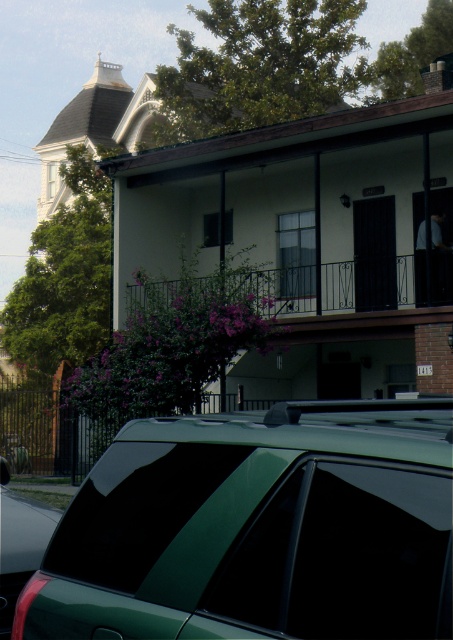
Question: Which object is the farthest from the metallic green car at lower left?

Choices:
 (A) iron black balcony at center
 (B) green matte car at lower center

Answer: (A)

Question: Is green matte car at lower center thinner than iron black balcony at center?

Choices:
 (A) no
 (B) yes

Answer: (A)

Question: Does iron black balcony at center appear on the left side of metallic green car at lower left?

Choices:
 (A) yes
 (B) no

Answer: (B)

Question: Among these points, which one is nearest to the camera?

Choices:
 (A) (197, 579)
 (B) (299, 312)

Answer: (A)

Question: Which object is farther from the camera taking this photo?

Choices:
 (A) green matte car at lower center
 (B) metallic green car at lower left
 (C) iron black balcony at center

Answer: (C)

Question: Is iron black balcony at center positioned in front of metallic green car at lower left?

Choices:
 (A) yes
 (B) no

Answer: (B)